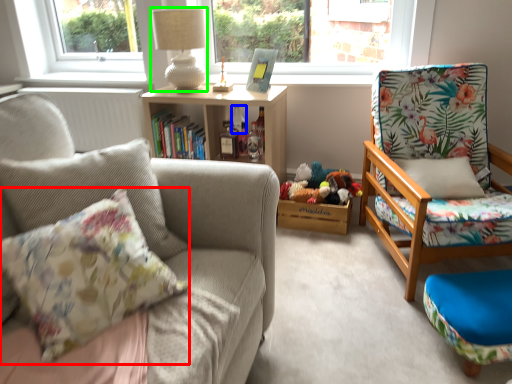
Question: Which object is the farthest from pillow (highlighted by a red box)? Choose among these: bottle (highlighted by a blue box) or lamp (highlighted by a green box).

Choices:
 (A) bottle
 (B) lamp

Answer: (A)